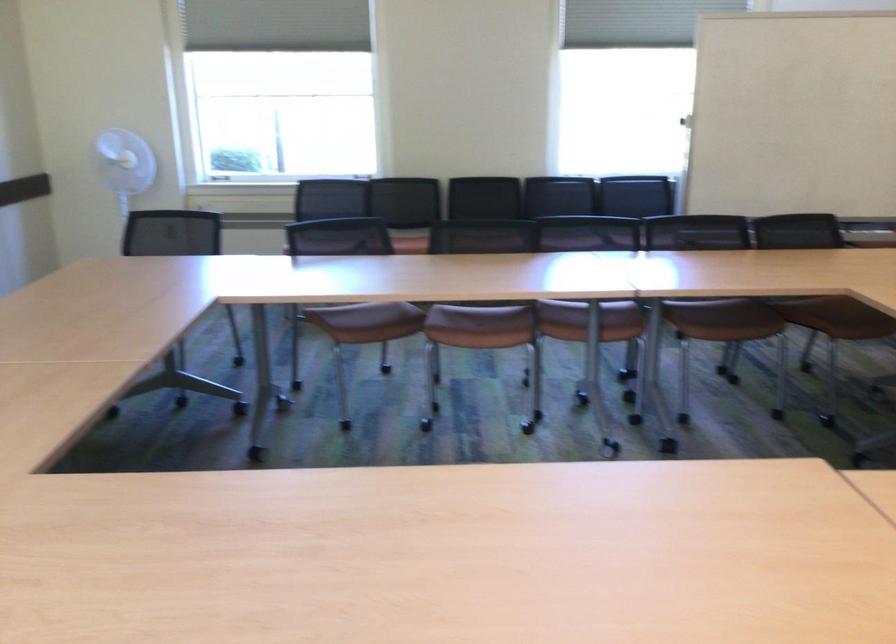
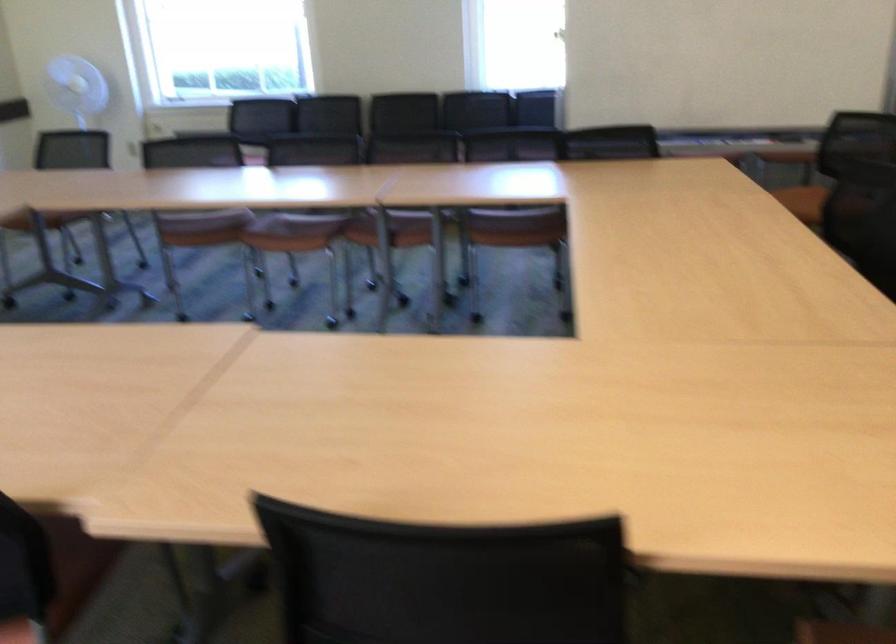
Locate, in the second image, the point that corresponds to pixel 487 332 in the first image.

(293, 232)